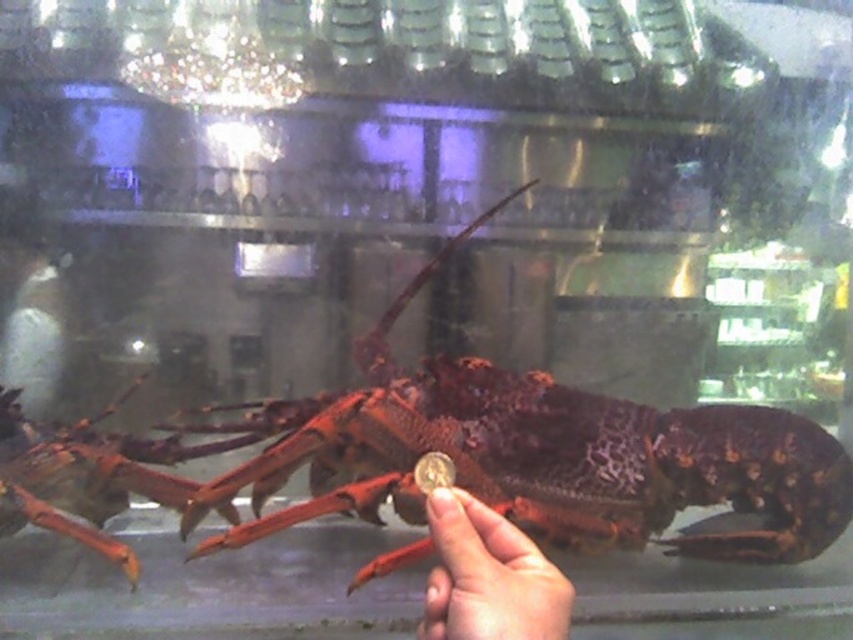
Question: Can you confirm if smooth skin hand at center is positioned above shiny metallic claw at center?

Choices:
 (A) yes
 (B) no

Answer: (B)

Question: Which of the following is the farthest from the observer?

Choices:
 (A) smooth skin hand at center
 (B) shiny metallic claw at center
 (C) shiny brown lobster at center

Answer: (C)

Question: Does shiny brown lobster at center appear on the right side of smooth skin hand at center?

Choices:
 (A) no
 (B) yes

Answer: (B)

Question: Among these objects, which one is farthest from the camera?

Choices:
 (A) smooth skin hand at center
 (B) shiny brown lobster at center

Answer: (B)

Question: Which object appears farthest from the camera in this image?

Choices:
 (A) shiny brown lobster at center
 (B) smooth skin hand at center
 (C) shiny metallic claw at center

Answer: (A)

Question: Does shiny brown lobster at center have a lesser width compared to shiny metallic claw at center?

Choices:
 (A) yes
 (B) no

Answer: (B)